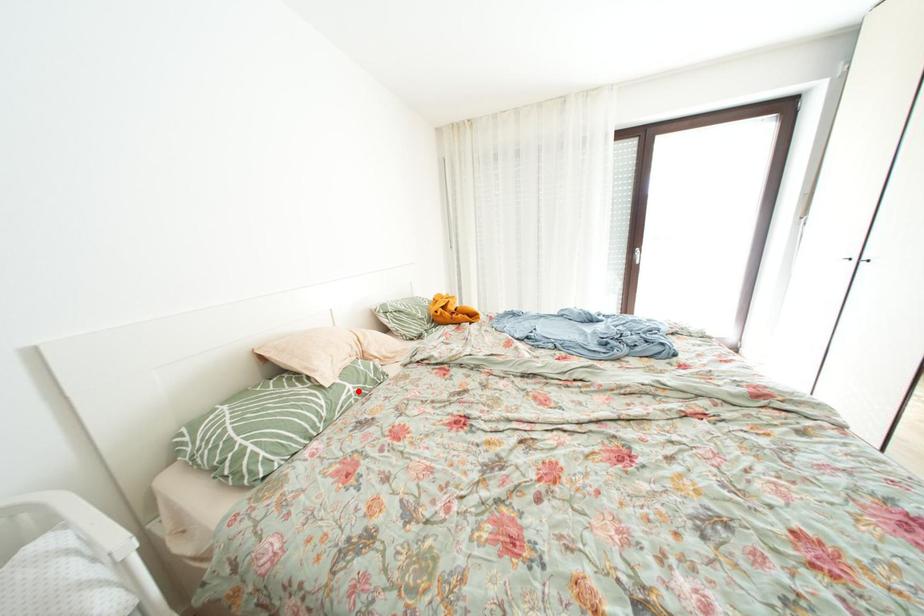
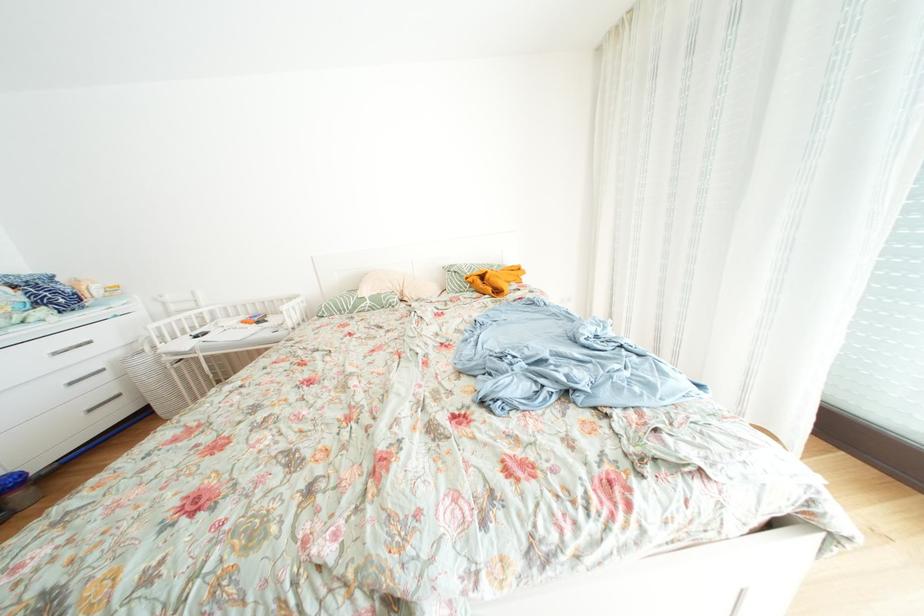
In the second image, find the point that corresponds to the highlighted location in the first image.

(378, 307)